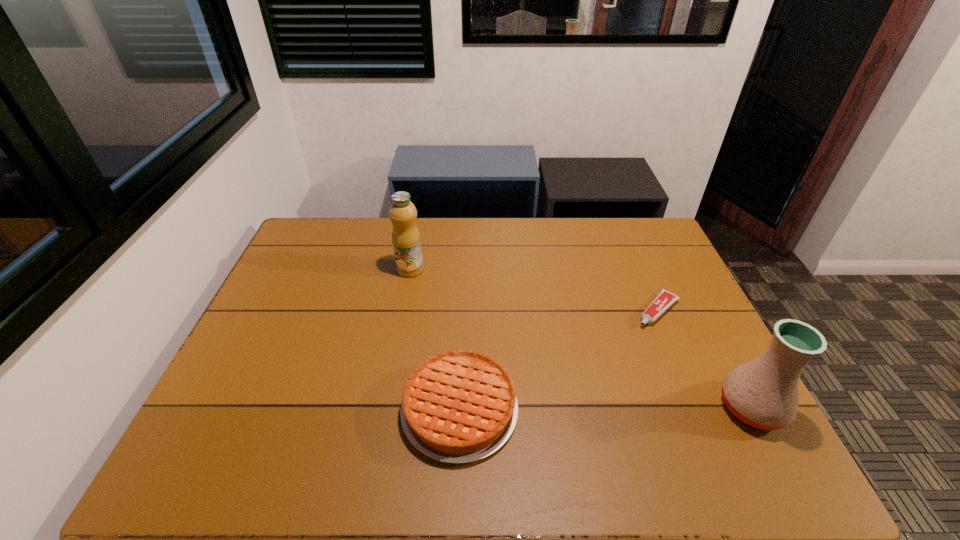
Locate an element on the screen. This screenshot has width=960, height=540. vacant spot on the desktop that is between the pie and the pottery and is positioned at the nozzle of the toothpaste is located at coordinates (565, 409).

I want to click on vacant space on the desktop that is between the pie and the pottery and is positioned on the front label of the farthest object, so click(x=591, y=409).